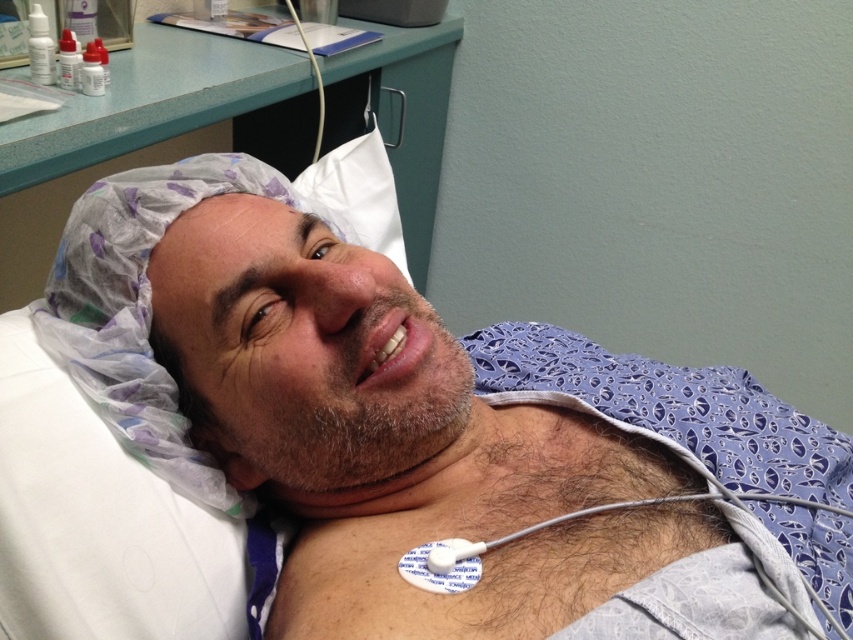
Question: Which point is farther from the camera taking this photo?

Choices:
 (A) (518, 628)
 (B) (401, 208)

Answer: (B)

Question: Among these points, which one is farthest from the camera?

Choices:
 (A) (204, 84)
 (B) (602, 484)

Answer: (A)

Question: Is white fabric at center wider than white plastic hair cover at upper left?

Choices:
 (A) no
 (B) yes

Answer: (A)

Question: Is white fabric at center above white plastic hair cover at upper left?

Choices:
 (A) no
 (B) yes

Answer: (A)

Question: Can you confirm if white fabric at center is positioned to the left of white plastic hair cover at upper left?

Choices:
 (A) no
 (B) yes

Answer: (A)